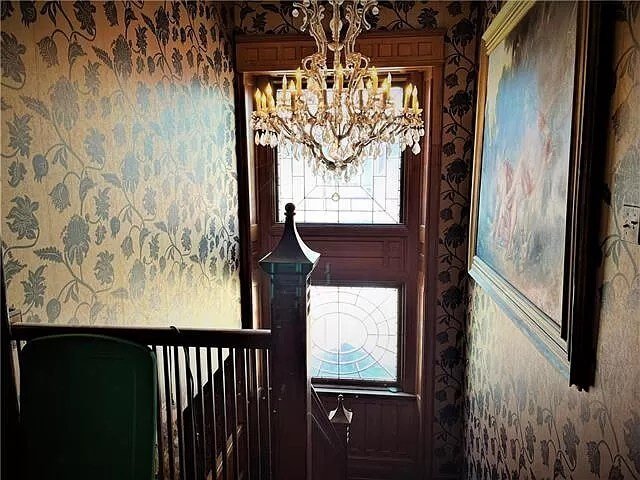
Where is `floral leaves wall paper`? The image size is (640, 480). floral leaves wall paper is located at coordinates (532, 405), (152, 273).